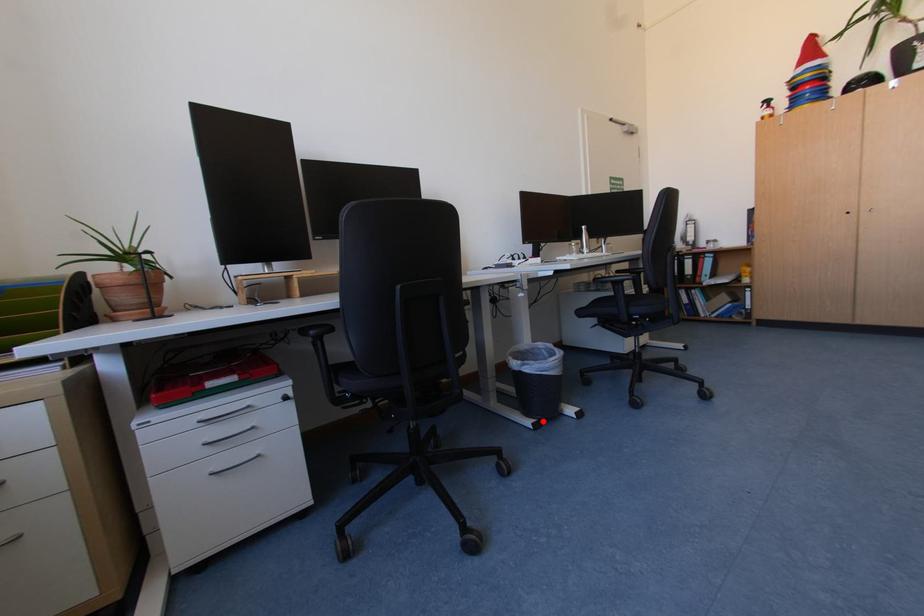
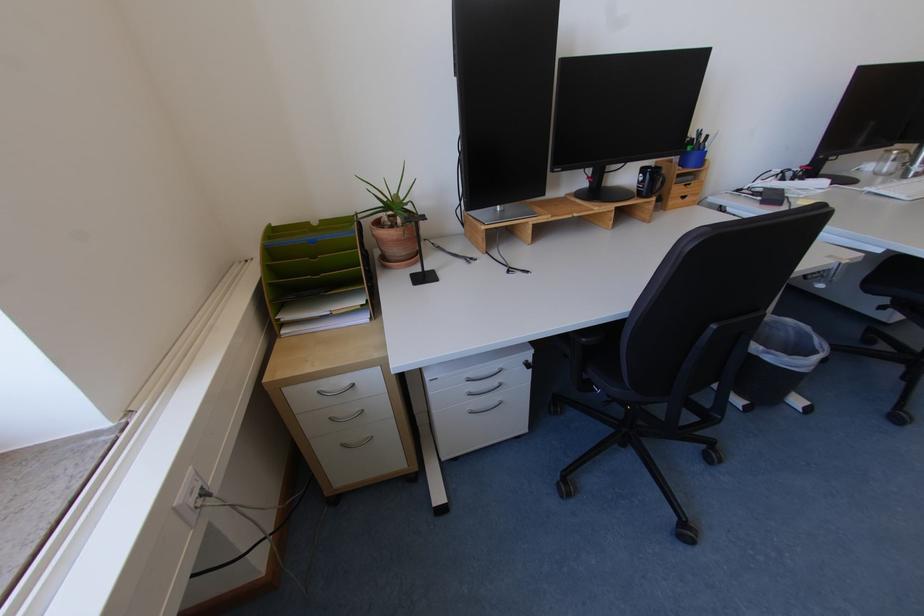
The point at the highlighted location is marked in the first image. Where is the corresponding point in the second image?

(755, 403)